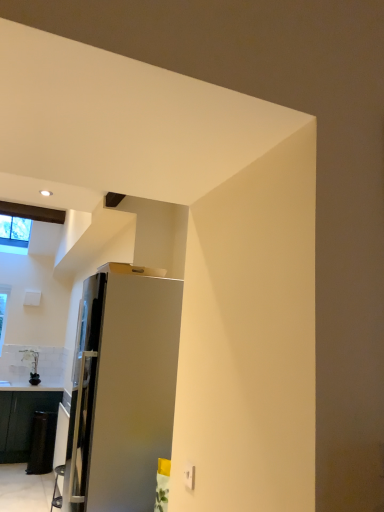
Question: Is point (180, 318) closer or farther from the camera than point (18, 237)?

Choices:
 (A) farther
 (B) closer

Answer: (B)

Question: Considering the positions of satin silver refrigerator at center and clear glass window at upper left in the image, is satin silver refrigerator at center wider or thinner than clear glass window at upper left?

Choices:
 (A) wide
 (B) thin

Answer: (B)

Question: Estimate the real-world distances between objects in this image. Which object is farther from the black glossy cabinet at lower left?

Choices:
 (A) clear glass window at upper left
 (B) satin silver refrigerator at center

Answer: (B)

Question: Which object is the closest to the black glossy cabinet at lower left?

Choices:
 (A) satin silver refrigerator at center
 (B) clear glass window at upper left

Answer: (B)